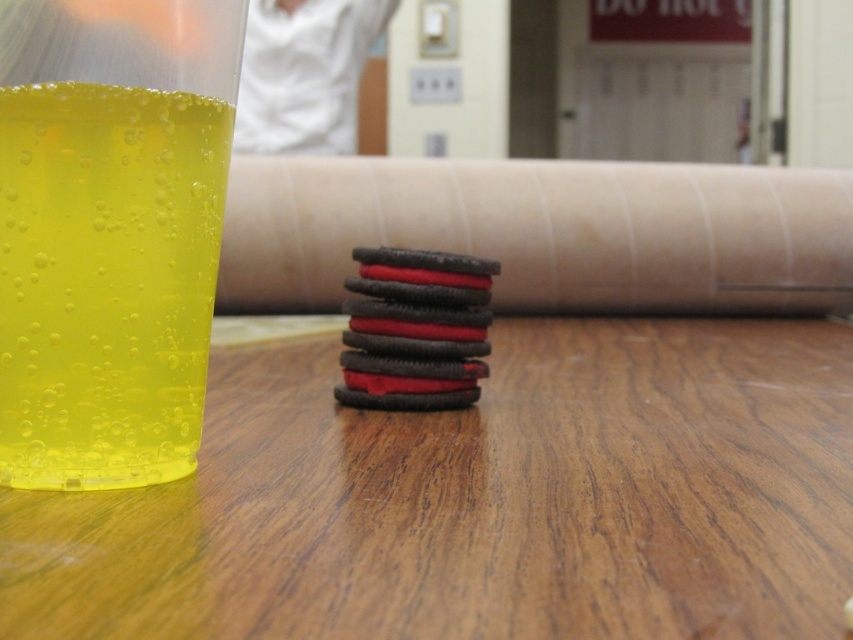
Question: Does wooden table at center have a lesser width compared to translucent yellow liquid at left?

Choices:
 (A) no
 (B) yes

Answer: (A)

Question: Observing the image, what is the correct spatial positioning of wooden table at center in reference to translucent yellow liquid at left?

Choices:
 (A) right
 (B) left

Answer: (A)

Question: Which point is farther to the camera?

Choices:
 (A) (201, 284)
 (B) (190, 564)

Answer: (A)

Question: Is wooden table at center thinner than translucent yellow liquid at left?

Choices:
 (A) no
 (B) yes

Answer: (A)

Question: Which point is closer to the camera?

Choices:
 (A) translucent yellow liquid at left
 (B) wooden table at center

Answer: (B)